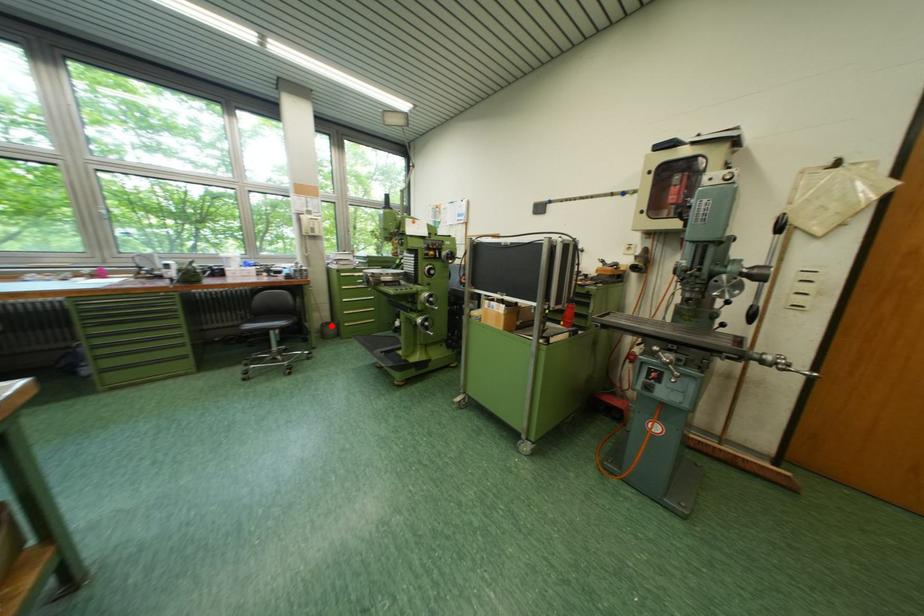
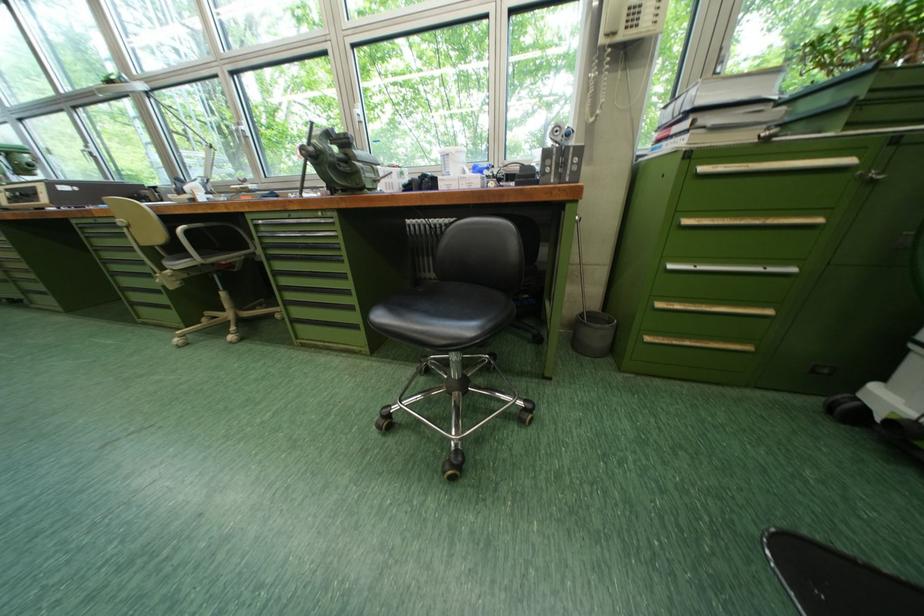
Question: A red point is marked in image1. In image2, is the corresponding 3D point closer to the camera or farther? Reply with the corresponding letter.

Choices:
 (A) The corresponding 3D point is closer.
 (B) The corresponding 3D point is farther.

Answer: (A)